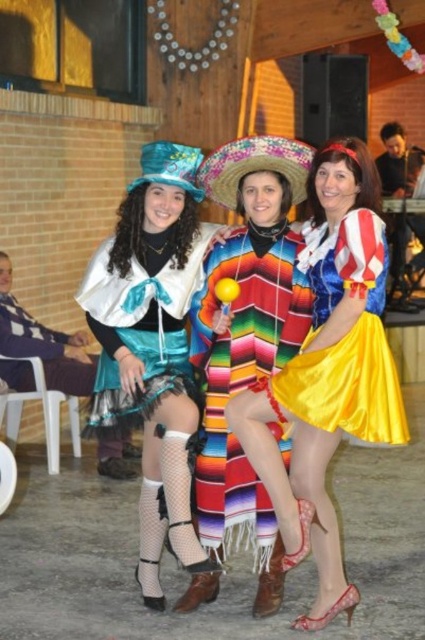
You are a photographer at the event and want to capture a photo of the two central performers. The yellow satin skirt at center and the shiny teal cape at center are both in the frame. Which one is positioned more to the right?

The yellow satin skirt at center is positioned more to the right than the shiny teal cape at center.

You are at the event and want to take a photo of both the shiny teal fabric dress at left and the multicolored woven poncho at center. To ensure both are in the frame, should you position yourself to the left or right of the two women?

You should position yourself to the right of the two women because the shiny teal fabric dress at left is to the left of the multicolored woven poncho at center, so standing to the right would allow both to be captured in the photo frame.